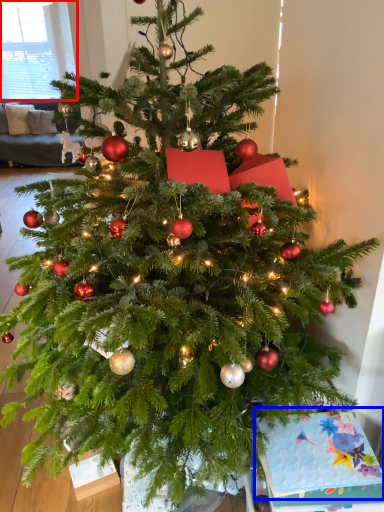
Question: Among these objects, which one is nearest to the camera, window screen (highlighted by a red box) or christmas card (highlighted by a blue box)?

Choices:
 (A) window screen
 (B) christmas card

Answer: (B)